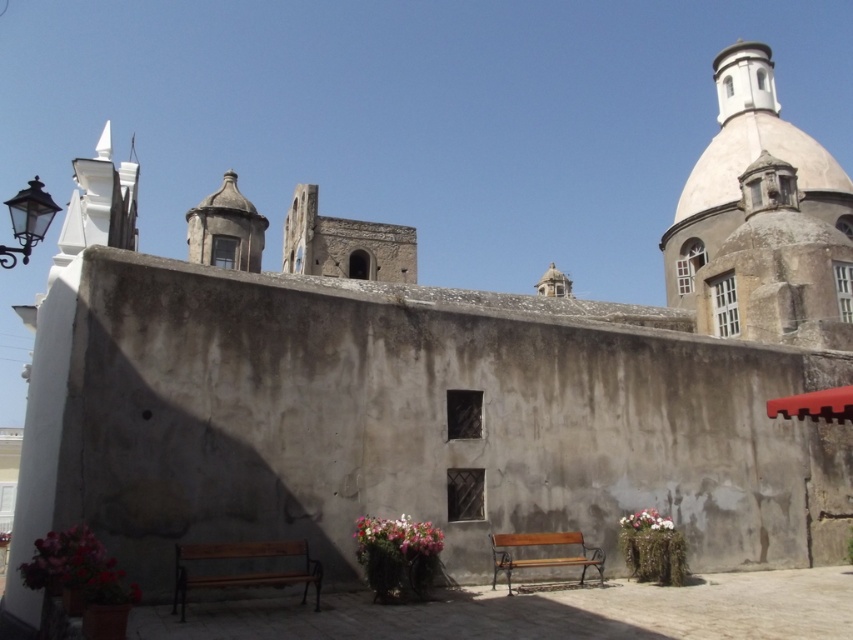
Question: Estimate the real-world distances between objects in this image. Which object is closer to the pink fabric flowers at lower right?

Choices:
 (A) smooth beige dome at upper right
 (B) wooden bench at center
 (C) pink fabric flower at lower left

Answer: (B)

Question: Which point is farther to the camera?

Choices:
 (A) smooth beige dome at upper right
 (B) wooden bench at center
 (C) pink fabric flowers at lower right

Answer: (A)

Question: Can you confirm if smooth beige dome at upper right is positioned above pink fabric flowers at lower right?

Choices:
 (A) yes
 (B) no

Answer: (A)

Question: Does wooden bench at center appear on the left side of pink matte flower pot at center?

Choices:
 (A) yes
 (B) no

Answer: (B)

Question: Does pink matte flower pot at center appear over pink fabric flowers at lower right?

Choices:
 (A) yes
 (B) no

Answer: (A)

Question: Among these objects, which one is nearest to the camera?

Choices:
 (A) brown wooden bench at lower center
 (B) pink fabric flowers at lower right
 (C) wooden bench at center
 (D) pink matte flower pot at center

Answer: (A)